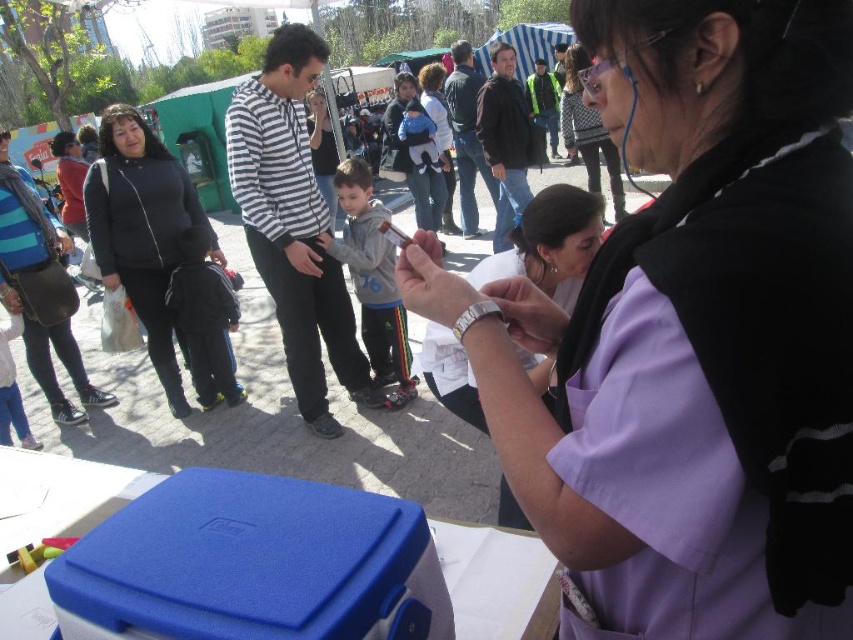
You are a photographer standing at the edge of the event area. You want to take a photo that includes both the dark gray fleece jacket at center and the matte purple shirt at center. Given that your camera has a maximum focus range of 4 meters, will you be able to capture both subjects in focus without moving closer?

The distance between the dark gray fleece jacket at center and the matte purple shirt at center is 4.26 meters. Since the camera can only focus up to 4 meters, the subjects are slightly out of the focus range. Therefore, you won photography move closer to ensure both are in focus.

You are a photographer at the event and want to take a portrait of the woman. You notice the dark gray fleece jacket at center and the matte purple shirt at center. Which clothing item is positioned to the left of the other?

The dark gray fleece jacket at center is to the left of the matte purple shirt at center.